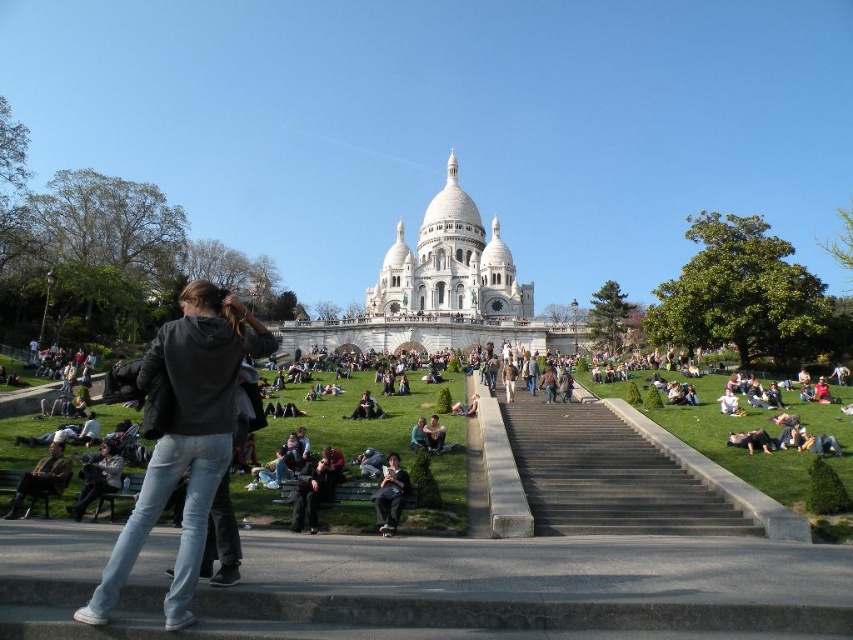
Question: Estimate the real-world distances between objects in this image. Which object is closer to the black concrete stairs at center?

Choices:
 (A) dark gray hoodie at center
 (B) dark gray fabric jacket at center
 (C) jeans at lower left
 (D) brown leather jacket at lower left

Answer: (B)

Question: Is dark gray hoodie at center to the left of dark gray fabric jacket at center from the viewer's perspective?

Choices:
 (A) no
 (B) yes

Answer: (B)

Question: Based on their relative distances, which object is nearer to the dark gray hoodie at center?

Choices:
 (A) brown leather jacket at lower left
 (B) black concrete stairs at center

Answer: (A)

Question: Which object appears farthest from the camera in this image?

Choices:
 (A) brown leather jacket at lower left
 (B) dark gray fabric jacket at center
 (C) dark gray hoodie at center
 (D) jeans at lower left

Answer: (B)

Question: Can you confirm if jeans at lower left is thinner than brown leather jacket at lower left?

Choices:
 (A) no
 (B) yes

Answer: (B)

Question: In this image, where is green grass at center located relative to dark gray fabric jacket at center?

Choices:
 (A) right
 (B) left

Answer: (A)